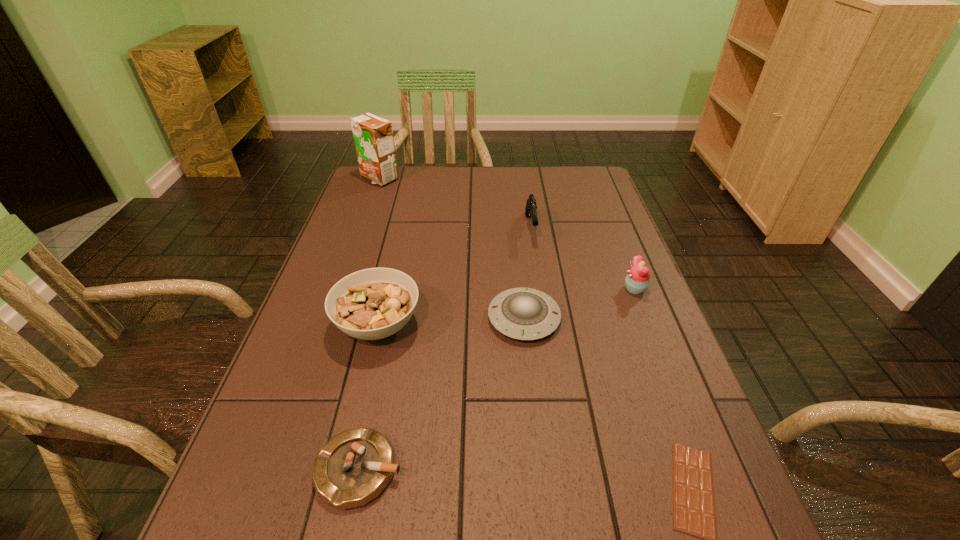
Identify which object is located as the third nearest to the farthest object. Please provide its 2D coordinates. Your answer should be formatted as a tuple, i.e. [(x, y)], where the tuple contains the x and y coordinates of a point satisfying the conditions above.

[(520, 313)]

Where is `object that is the second closest one to the farthest object`? object that is the second closest one to the farthest object is located at coordinates (370, 304).

The image size is (960, 540). I want to click on free space that satisfies the following two spatial constraints: 1. on the face of the cupcake; 2. on the front side of the stew, so click(x=649, y=325).

Find the location of a particular element. free space in the image that satisfies the following two spatial constraints: 1. on the straw side of the farthest object; 2. on the right side of the sixth tallest object is located at coordinates (276, 469).